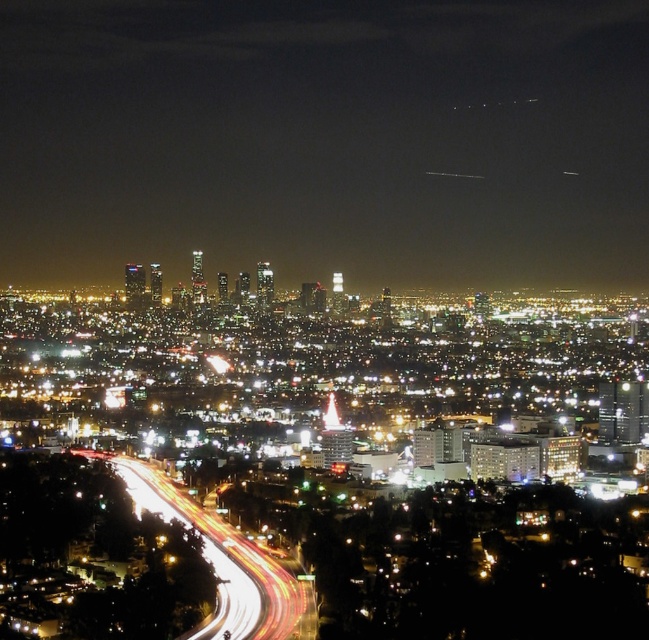
Is glittering glass skyscrapers at center to the right of white light trails at lower left from the viewer's perspective?

Yes, glittering glass skyscrapers at center is to the right of white light trails at lower left.

Is glittering glass skyscrapers at center taller than white light trails at lower left?

Yes.

The width and height of the screenshot is (649, 640). In order to click on glittering glass skyscrapers at center in this screenshot , I will do `click(326, 140)`.